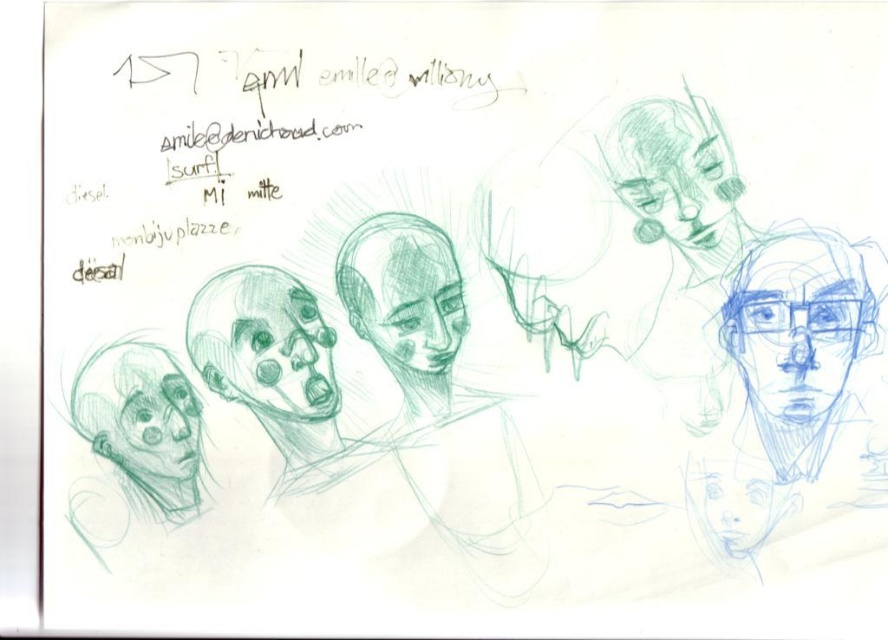
You are an art student analyzing the drawing. You need to locate the green pencil sketch face at upper right precisely. What are its coordinates?

The green pencil sketch face at upper right is located at coordinates (678,179).

You are an artist analyzing a sketch of abstract faces. You notice two points marked on the drawing at coordinates point (771, 328) and point (264, 314). Based on the perspective of the sketch, which point is positioned closer to the viewer?

Point (771, 328) is closer to the viewer than point (264, 314).

You are an artist reviewing a sketch. You notice two points marked on the paper at coordinates point (700, 173) and point (427, 324). Based on their positions, which point is closer to the viewer?

Point (700, 173) is in front of point (427, 324), so it is closer to the viewer.